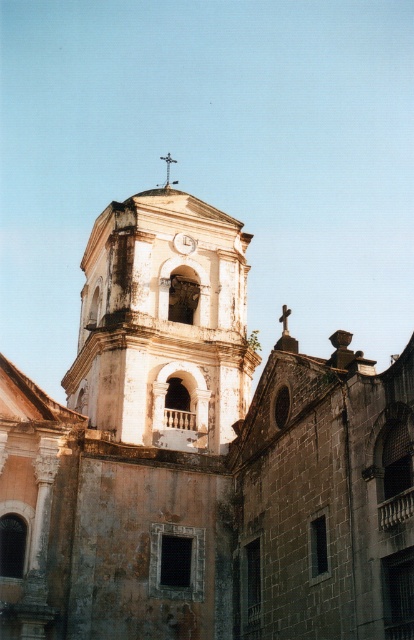
Question: Which point is closer to the camera taking this photo?

Choices:
 (A) (168, 179)
 (B) (178, 234)

Answer: (B)

Question: Is metallic silver clock at center above metallic cross at upper center?

Choices:
 (A) yes
 (B) no

Answer: (B)

Question: Which object is positioned farthest from the white stone bell tower at center?

Choices:
 (A) metallic cross at upper center
 (B) metallic silver clock at center

Answer: (A)

Question: Observing the image, what is the correct spatial positioning of white stone bell tower at center in reference to metallic silver clock at center?

Choices:
 (A) above
 (B) below

Answer: (B)

Question: Can you confirm if white stone bell tower at center is thinner than metallic silver clock at center?

Choices:
 (A) yes
 (B) no

Answer: (B)

Question: Which of the following is the closest to the observer?

Choices:
 (A) (168, 168)
 (B) (183, 243)
 (C) (166, 420)

Answer: (C)